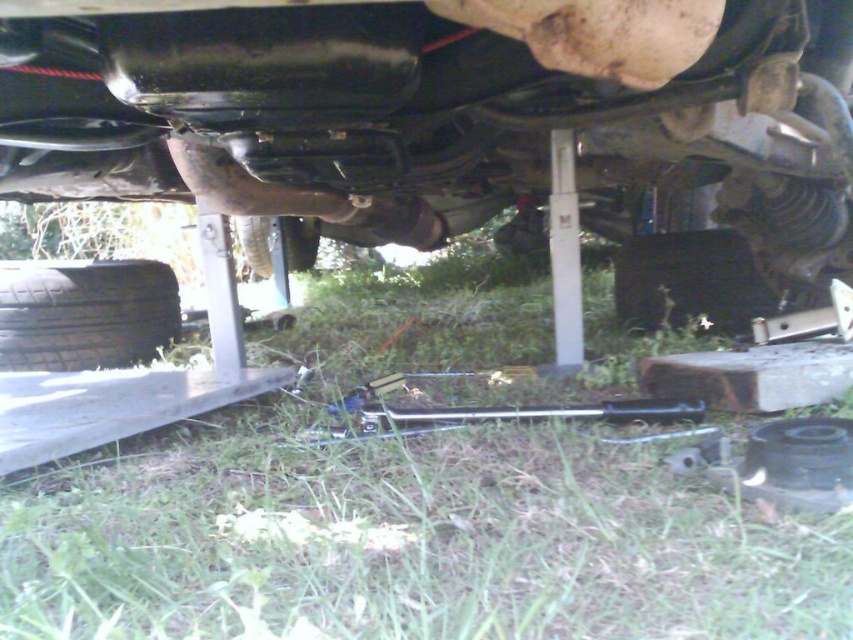
Is green grass at lower center to the right of matte black car at center from the viewer's perspective?

Incorrect, green grass at lower center is not on the right side of matte black car at center.

Is green grass at lower center above matte black car at center?

Actually, green grass at lower center is below matte black car at center.

The height and width of the screenshot is (640, 853). In order to click on green grass at lower center in this screenshot , I will do `click(403, 509)`.

Is green grass at lower center taller than rubber/soft tire at center?

Yes.

Which of these two, green grass at lower center or rubber/soft tire at center, stands taller?

green grass at lower center

Find the location of a particular element. green grass at lower center is located at coordinates (403, 509).

Does black rubber tire at lower left have a smaller size compared to rubber/soft tire at center?

Yes.

Does black rubber tire at lower left appear on the right side of rubber/soft tire at center?

Incorrect, black rubber tire at lower left is not on the right side of rubber/soft tire at center.

Is point (154, 300) closer to camera compared to point (300, 252)?

Yes, point (154, 300) is in front of point (300, 252).

The image size is (853, 640). Find the location of `black rubber tire at lower left`. black rubber tire at lower left is located at coordinates (85, 314).